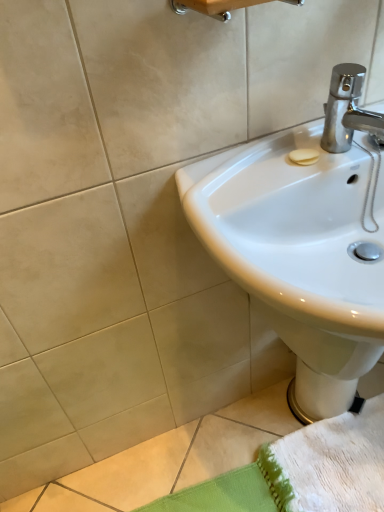
Question: From a real-world perspective, relative to wooden towel bar at upper center, is white glossy sink at upper right vertically above or below?

Choices:
 (A) below
 (B) above

Answer: (A)

Question: Is white glossy sink at upper right wider or thinner than wooden towel bar at upper center?

Choices:
 (A) wide
 (B) thin

Answer: (A)

Question: Which object is positioned farthest from the white glossy sink at upper right?

Choices:
 (A) white glossy bidet at lower right
 (B) wooden towel bar at upper center

Answer: (B)

Question: Estimate the real-world distances between objects in this image. Which object is farther from the white glossy bidet at lower right?

Choices:
 (A) white glossy sink at upper right
 (B) wooden towel bar at upper center

Answer: (B)